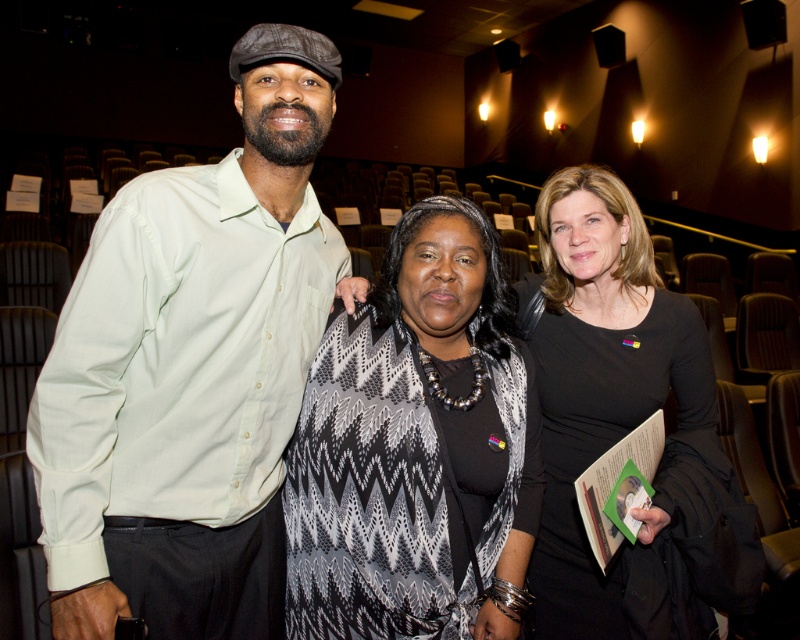
You are standing in the auditorium and want to take a photo of the matte green shirt at center. Where should you aim your camera to capture it?

The matte green shirt at center is located at the 2D coordinates point (192, 371), so you should aim your camera there to capture it.

You are a photographer setting up for an event. You notice the matte green shirt at center and the black and white zigzag scarf at center. Which clothing item is covering the other?

The matte green shirt at center is positioned over the black and white zigzag scarf at center, so the matte green shirt at center is covering the black and white zigzag scarf at center.